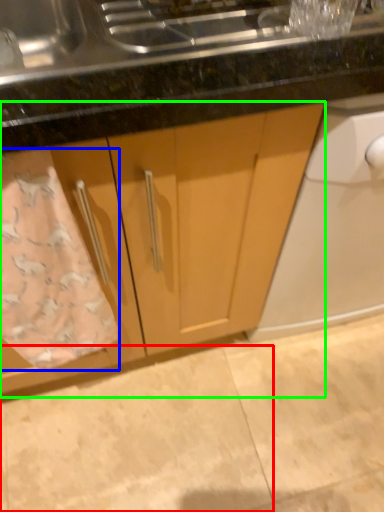
Question: Which object is positioned closest to granite (highlighted by a red box)? Select from bath towel (highlighted by a blue box) and cabinetry (highlighted by a green box).

Choices:
 (A) bath towel
 (B) cabinetry

Answer: (B)